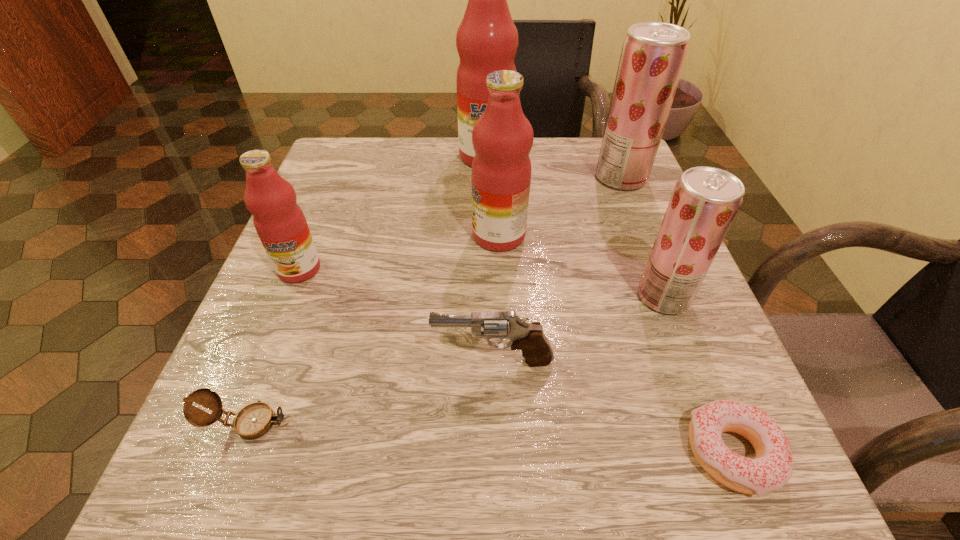
Locate which fruit juice ranks in proximity to the nearer strawberry fruit juice. Please provide its 2D coordinates. Your answer should be formatted as a tuple, i.e. [(x, y)], where the tuple contains the x and y coordinates of a point satisfying the conditions above.

[(502, 138)]

Locate which pink fruit juice is the third closest to the pistol. Please provide its 2D coordinates. Your answer should be formatted as a tuple, i.e. [(x, y)], where the tuple contains the x and y coordinates of a point satisfying the conditions above.

[(487, 40)]

Locate an element on the screen. The height and width of the screenshot is (540, 960). pink fruit juice that stands as the closest to the sixth tallest object is located at coordinates (502, 138).

Image resolution: width=960 pixels, height=540 pixels. I want to click on vacant position in the image that satisfies the following two spatial constraints: 1. on the label of the tallest object; 2. on the face of the seventh tallest object, so click(x=491, y=422).

Find the location of `vacant area in the image that satisfies the following two spatial constraints: 1. on the back side of the white doughnut; 2. on the face of the seventh tallest object`. vacant area in the image that satisfies the following two spatial constraints: 1. on the back side of the white doughnut; 2. on the face of the seventh tallest object is located at coordinates 720,422.

You are a GUI agent. You are given a task and a screenshot of the screen. Output one action in this format:
    pyautogui.click(x=<x>, y=<y>)
    Task: Click on the vacant space that satisfies the following two spatial constraints: 1. on the label of the nearer strawberry fruit juice; 2. on the left side of the third farthest object
    
    Given the screenshot: What is the action you would take?
    pyautogui.click(x=502, y=296)

At what (x,y) coordinates should I click in order to perform the action: click on vacant position in the image that satisfies the following two spatial constraints: 1. on the label of the third nearest fruit juice; 2. on the left side of the smaller strawberry fruit juice. Please return your answer as a coordinate pair (x, y). Looking at the image, I should click on [502, 296].

Find the location of a particular element. vacant area in the image that satisfies the following two spatial constraints: 1. at the barrel of the third nearest object; 2. on the back side of the white doughnut is located at coordinates (495, 454).

Identify the location of blank area in the image that satisfies the following two spatial constraints: 1. on the label of the nearer strawberry fruit juice; 2. on the left side of the nearest pink fruit juice. Image resolution: width=960 pixels, height=540 pixels. (288, 296).

Locate an element on the screen. The height and width of the screenshot is (540, 960). free spot that satisfies the following two spatial constraints: 1. on the label of the second farthest pink fruit juice; 2. on the label of the nearest pink fruit juice is located at coordinates (500, 269).